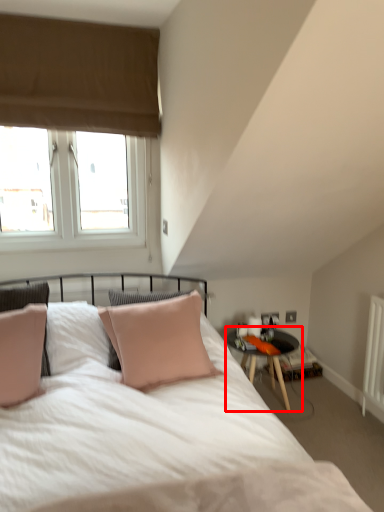
Question: Where is table (annotated by the red box) located in relation to window in the image?

Choices:
 (A) right
 (B) left

Answer: (A)